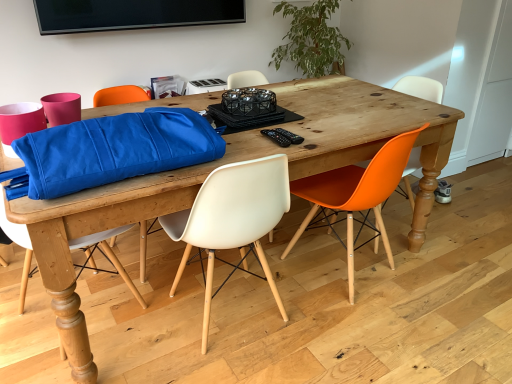
This screenshot has width=512, height=384. What do you see at coordinates (356, 196) in the screenshot?
I see `orange matte plastic chair at right, which is the second chair from right to left` at bounding box center [356, 196].

You are a GUI agent. You are given a task and a screenshot of the screen. Output one action in this format:
    pyautogui.click(x=<x>, y=<y>)
    Task: Click on the orange matte plastic chair at right, placed as the 3th chair when sorted from left to right
    The width and height of the screenshot is (512, 384).
    Given the screenshot: What is the action you would take?
    pyautogui.click(x=356, y=196)

This screenshot has height=384, width=512. In order to click on green leafy plant at upper center in this screenshot , I will do `click(311, 39)`.

What do you see at coordinates (420, 88) in the screenshot? I see `orange matte plastic chair at right, marked as the fourth chair in a left-to-right arrangement` at bounding box center [420, 88].

What is the approximate height of white plastic chair at center, which is the fourth chair from right to left?

It is 32.41 inches.

You are a GUI agent. You are given a task and a screenshot of the screen. Output one action in this format:
    pyautogui.click(x=<x>, y=<y>)
    Task: Click on the orange matte plastic chair at right, which is the second chair from right to left
    The image size is (512, 384).
    Given the screenshot: What is the action you would take?
    point(356,196)

Is wooden table at center placed right next to orange matte plastic chair at right, marked as the fourth chair in a left-to-right arrangement?

They are not placed beside each other.

Which object is wider, wooden table at center or orange matte plastic chair at right, which is the 1th chair from right to left?

wooden table at center is wider.

From the picture: Does wooden table at center have a larger size compared to orange matte plastic chair at right, marked as the fourth chair in a left-to-right arrangement?

Correct, wooden table at center is larger in size than orange matte plastic chair at right, marked as the fourth chair in a left-to-right arrangement.

Which object is wider, black plastic remote control at center, the 1th remote control in the left-to-right sequence, or black plastic remote control at center, the first remote control when ordered from right to left?

Wider between the two is black plastic remote control at center, the 1th remote control in the left-to-right sequence.

Can you confirm if black plastic remote control at center, the 1th remote control in the left-to-right sequence, is taller than black plastic remote control at center, acting as the second remote control starting from the left?

No, black plastic remote control at center, the 1th remote control in the left-to-right sequence, is not taller than black plastic remote control at center, acting as the second remote control starting from the left.

What's the angular difference between black plastic remote control at center, which is the 2th remote control in right-to-left order, and black plastic remote control at center, the first remote control when ordered from right to left,'s facing directions?

The angle between the facing direction of black plastic remote control at center, which is the 2th remote control in right-to-left order, and the facing direction of black plastic remote control at center, the first remote control when ordered from right to left, is 0.355 degrees.

From the image's perspective, is black plastic remote control at center, which is the 2th remote control in right-to-left order, beneath black plastic remote control at center, the first remote control when ordered from right to left?

Indeed, from the image's perspective, black plastic remote control at center, which is the 2th remote control in right-to-left order, is shown beneath black plastic remote control at center, the first remote control when ordered from right to left.

Is point (328, 47) closer to camera compared to point (297, 138)?

No, (328, 47) is further to viewer.

I want to click on remote control that is the 1st one when counting forward from the green leafy plant at upper center, so click(290, 136).

Is black plastic remote control at center, the first remote control when ordered from right to left, at the back of green leafy plant at upper center?

green leafy plant at upper center is not turned away from black plastic remote control at center, the first remote control when ordered from right to left.

Which object is further away from the camera, green leafy plant at upper center or orange matte plastic chair at right, which is the second chair from right to left?

green leafy plant at upper center.

Is green leafy plant at upper center spatially inside orange matte plastic chair at right, which is the second chair from right to left, or outside of it?

green leafy plant at upper center is not inside orange matte plastic chair at right, which is the second chair from right to left, it's outside.

Which of these two, green leafy plant at upper center or orange matte plastic chair at right, which is the second chair from right to left, stands taller?

With more height is orange matte plastic chair at right, which is the second chair from right to left.

Is green leafy plant at upper center thinner than orange matte plastic chair at right, placed as the 3th chair when sorted from left to right?

Yes.

Is wooden table at center facing towards white plastic chair at center, which is counted as the third chair, starting from the right?

Yes, wooden table at center is oriented towards white plastic chair at center, which is counted as the third chair, starting from the right.

From a real-world perspective, is wooden table at center located beneath white plastic chair at center, marked as the 2th chair in a left-to-right arrangement?

Indeed, from a real-world perspective, wooden table at center is positioned beneath white plastic chair at center, marked as the 2th chair in a left-to-right arrangement.

Which is more to the right, wooden table at center or white plastic chair at center, which is counted as the third chair, starting from the right?

wooden table at center is more to the right.

Is wooden table at center not close to white plastic chair at center, which is counted as the third chair, starting from the right?

No, wooden table at center is not far from white plastic chair at center, which is counted as the third chair, starting from the right.

From a real-world perspective, is orange matte plastic chair at right, placed as the 3th chair when sorted from left to right, positioned under black plastic remote control at center, the 1th remote control in the left-to-right sequence, based on gravity?

Yes, from a real-world perspective, orange matte plastic chair at right, placed as the 3th chair when sorted from left to right, is beneath black plastic remote control at center, the 1th remote control in the left-to-right sequence.

From the image's perspective, which object appears higher, orange matte plastic chair at right, which is the second chair from right to left, or black plastic remote control at center, which is the 2th remote control in right-to-left order?

black plastic remote control at center, which is the 2th remote control in right-to-left order.

Does orange matte plastic chair at right, which is the second chair from right to left, turn towards black plastic remote control at center, which is the 2th remote control in right-to-left order?

No, orange matte plastic chair at right, which is the second chair from right to left, is not oriented towards black plastic remote control at center, which is the 2th remote control in right-to-left order.

Considering the sizes of orange matte plastic chair at right, which is the second chair from right to left, and black plastic remote control at center, which is the 2th remote control in right-to-left order, in the image, is orange matte plastic chair at right, which is the second chair from right to left, taller or shorter than black plastic remote control at center, which is the 2th remote control in right-to-left order,?

Clearly, orange matte plastic chair at right, which is the second chair from right to left, is taller compared to black plastic remote control at center, which is the 2th remote control in right-to-left order.

Which is behind, point (20, 308) or point (406, 84)?

The point (406, 84) is farther.

Considering the sizes of objects white plastic chair at center, the first chair from the left, and orange matte plastic chair at right, marked as the fourth chair in a left-to-right arrangement, in the image provided, who is wider, white plastic chair at center, the first chair from the left, or orange matte plastic chair at right, marked as the fourth chair in a left-to-right arrangement,?

Wider between the two is white plastic chair at center, the first chair from the left.

From a real-world perspective, is white plastic chair at center, which is the fourth chair from right to left, physically located above or below orange matte plastic chair at right, which is the 1th chair from right to left?

From a real-world perspective, white plastic chair at center, which is the fourth chair from right to left, is physically above orange matte plastic chair at right, which is the 1th chair from right to left.

How different are the orientations of white plastic chair at center, which is the fourth chair from right to left, and orange matte plastic chair at right, marked as the fourth chair in a left-to-right arrangement, in degrees?

The angular difference between white plastic chair at center, which is the fourth chair from right to left, and orange matte plastic chair at right, marked as the fourth chair in a left-to-right arrangement, is 162 degrees.

Locate an element on the screen. desk in front of the orange matte plastic chair at right, marked as the fourth chair in a left-to-right arrangement is located at coordinates tap(232, 162).

Image resolution: width=512 pixels, height=384 pixels. Identify the location of remote control above the black plastic remote control at center, the 1th remote control in the left-to-right sequence (from the image's perspective). (290, 136).

Which object lies nearer to the anchor point white plastic chair at center, the first chair from the left, orange matte plastic chair at right, which is the second chair from right to left, or white plastic chair at center, marked as the 2th chair in a left-to-right arrangement?

Among the two, white plastic chair at center, marked as the 2th chair in a left-to-right arrangement, is located nearer to white plastic chair at center, the first chair from the left.

Looking at the image, which one is located closer to orange matte plastic chair at right, which is the second chair from right to left, white plastic chair at center, which is counted as the third chair, starting from the right, or black plastic remote control at center, the first remote control when ordered from right to left?

white plastic chair at center, which is counted as the third chair, starting from the right, is positioned closer to the anchor orange matte plastic chair at right, which is the second chair from right to left.

Based on the photo, from the image, which object appears to be nearer to wooden table at center, orange matte plastic chair at right, placed as the 3th chair when sorted from left to right, or white plastic chair at center, which is counted as the third chair, starting from the right?

Among the two, orange matte plastic chair at right, placed as the 3th chair when sorted from left to right, is located nearer to wooden table at center.

Based on their spatial positions, is wooden table at center or black plastic remote control at center, the 1th remote control in the left-to-right sequence, further from orange matte plastic chair at right, which is the second chair from right to left?

black plastic remote control at center, the 1th remote control in the left-to-right sequence, lies further to orange matte plastic chair at right, which is the second chair from right to left, than the other object.

From the picture: From the image, which object appears to be farther from green leafy plant at upper center, white plastic chair at center, which is the fourth chair from right to left, or white plastic chair at center, which is counted as the third chair, starting from the right?

Among the two, white plastic chair at center, which is the fourth chair from right to left, is located further to green leafy plant at upper center.

When comparing their distances from orange matte plastic chair at right, which is the 1th chair from right to left, does white plastic chair at center, the first chair from the left, or wooden table at center seem closer?

wooden table at center.

Which object lies nearer to the anchor point wooden table at center, black plastic remote control at center, the first remote control when ordered from right to left, or green leafy plant at upper center?

black plastic remote control at center, the first remote control when ordered from right to left.

Which object lies further to the anchor point black plastic remote control at center, which is the 2th remote control in right-to-left order, white plastic chair at center, which is counted as the third chair, starting from the right, or green leafy plant at upper center?

Among the two, green leafy plant at upper center is located further to black plastic remote control at center, which is the 2th remote control in right-to-left order.

I want to click on chair between black plastic remote control at center, the 1th remote control in the left-to-right sequence, and orange matte plastic chair at right, marked as the fourth chair in a left-to-right arrangement, in the horizontal direction, so click(x=356, y=196).

Where is `desk between white plastic chair at center, which is the fourth chair from right to left, and black plastic remote control at center, which is the 2th remote control in right-to-left order`? The width and height of the screenshot is (512, 384). desk between white plastic chair at center, which is the fourth chair from right to left, and black plastic remote control at center, which is the 2th remote control in right-to-left order is located at coordinates (232, 162).

Where is `remote control located between black plastic remote control at center, the 1th remote control in the left-to-right sequence, and orange matte plastic chair at right, placed as the 3th chair when sorted from left to right, in the left-right direction`? This screenshot has height=384, width=512. remote control located between black plastic remote control at center, the 1th remote control in the left-to-right sequence, and orange matte plastic chair at right, placed as the 3th chair when sorted from left to right, in the left-right direction is located at coordinates (290, 136).

At what (x,y) coordinates should I click in order to perform the action: click on desk between white plastic chair at center, marked as the 2th chair in a left-to-right arrangement, and orange matte plastic chair at right, placed as the 3th chair when sorted from left to right. Please return your answer as a coordinate pair (x, y). This screenshot has width=512, height=384. Looking at the image, I should click on (232, 162).